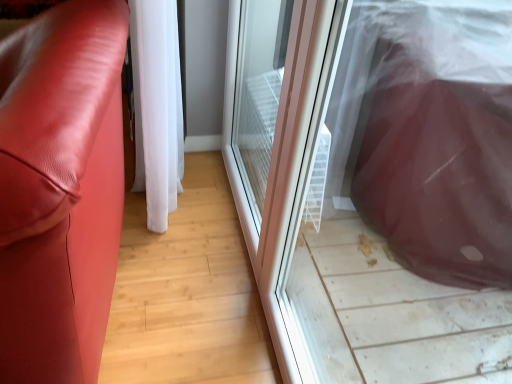
Question: Is transparent plastic screen door at center, arranged as the 2th screen door when viewed from the front, at the left side of transparent plastic screen door at right, which is the second screen door in back-to-front order?

Choices:
 (A) no
 (B) yes

Answer: (B)

Question: Can you confirm if transparent plastic screen door at center, the 1th screen door when ordered from back to front, is taller than transparent plastic screen door at right, the 1th screen door in the front-to-back sequence?

Choices:
 (A) no
 (B) yes

Answer: (A)

Question: Is transparent plastic screen door at center, the 1th screen door when ordered from back to front, oriented towards transparent plastic screen door at right, the 1th screen door in the front-to-back sequence?

Choices:
 (A) yes
 (B) no

Answer: (B)

Question: Is transparent plastic screen door at center, the 1th screen door when ordered from back to front, smaller than transparent plastic screen door at right, which is the second screen door in back-to-front order?

Choices:
 (A) yes
 (B) no

Answer: (B)

Question: Is transparent plastic screen door at center, arranged as the 2th screen door when viewed from the front, oriented away from transparent plastic screen door at right, which is the second screen door in back-to-front order?

Choices:
 (A) yes
 (B) no

Answer: (B)

Question: Is point (280, 122) positioned closer to the camera than point (54, 51)?

Choices:
 (A) farther
 (B) closer

Answer: (A)

Question: Is transparent plastic screen door at center, arranged as the 2th screen door when viewed from the front, wider or thinner than matte leather couch at left?

Choices:
 (A) thin
 (B) wide

Answer: (A)

Question: Considering their positions, is transparent plastic screen door at center, arranged as the 2th screen door when viewed from the front, located in front of or behind matte leather couch at left?

Choices:
 (A) behind
 (B) front

Answer: (A)

Question: From the image's perspective, is transparent plastic screen door at center, arranged as the 2th screen door when viewed from the front, located above or below matte leather couch at left?

Choices:
 (A) above
 (B) below

Answer: (A)

Question: From their relative heights in the image, would you say white sheer curtain at center is taller or shorter than transparent plastic screen door at right, which is the second screen door in back-to-front order?

Choices:
 (A) tall
 (B) short

Answer: (B)

Question: Looking at the image, does white sheer curtain at center seem bigger or smaller compared to transparent plastic screen door at right, which is the second screen door in back-to-front order?

Choices:
 (A) big
 (B) small

Answer: (A)

Question: Considering their positions, is white sheer curtain at center located in front of or behind transparent plastic screen door at right, the 1th screen door in the front-to-back sequence?

Choices:
 (A) behind
 (B) front

Answer: (A)

Question: Is point (161, 34) positioned closer to the camera than point (278, 271)?

Choices:
 (A) closer
 (B) farther

Answer: (A)

Question: Considering the positions of matte leather couch at left and transparent plastic screen door at center, the 1th screen door when ordered from back to front, in the image, is matte leather couch at left bigger or smaller than transparent plastic screen door at center, the 1th screen door when ordered from back to front,?

Choices:
 (A) small
 (B) big

Answer: (B)

Question: From a real-world perspective, is matte leather couch at left physically located above or below transparent plastic screen door at center, arranged as the 2th screen door when viewed from the front?

Choices:
 (A) above
 (B) below

Answer: (B)